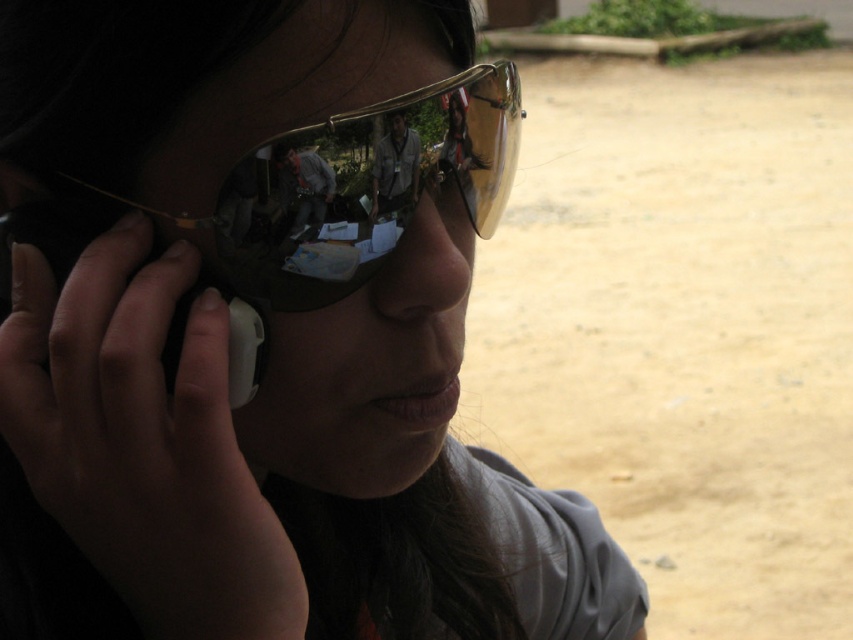
Question: Does gold reflective sunglasses at center appear on the left side of black plastic smartphone at left?

Choices:
 (A) no
 (B) yes

Answer: (A)

Question: Does gold reflective sunglasses at center appear under black plastic smartphone at left?

Choices:
 (A) yes
 (B) no

Answer: (B)

Question: Does gold reflective sunglasses at center have a greater width compared to black plastic smartphone at left?

Choices:
 (A) yes
 (B) no

Answer: (A)